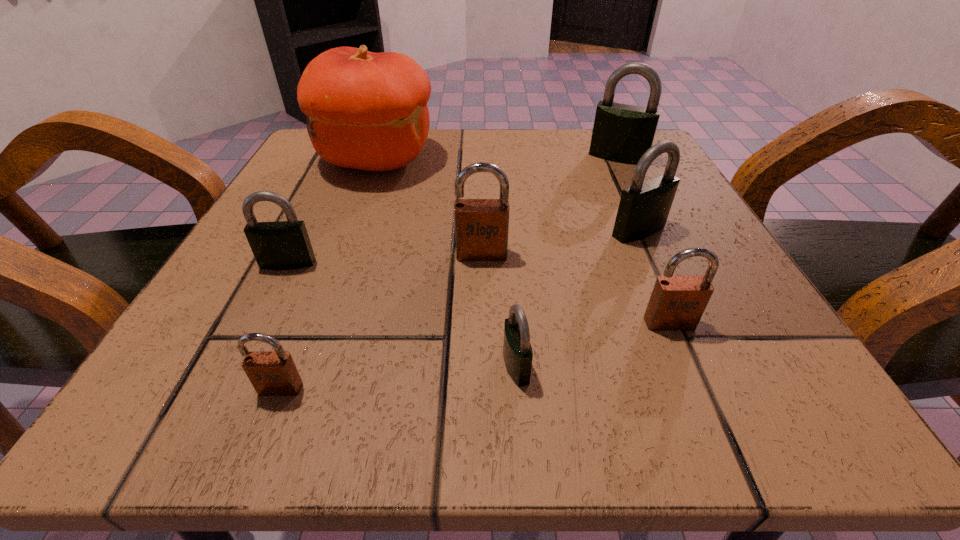
The height and width of the screenshot is (540, 960). Find the location of `the fifth farthest padlock`. the fifth farthest padlock is located at coordinates (677, 302).

Identify the location of the second black padlock from left to right. (517, 351).

Find the location of a particular element. Image resolution: width=960 pixels, height=540 pixels. the nearest black padlock is located at coordinates (517, 351).

I want to click on the nearest brown padlock, so click(x=272, y=373).

Identify the location of the smallest brown padlock. tap(272, 373).

Where is `vacant area situated 0.350m on the front of the pumpkin`? The image size is (960, 540). vacant area situated 0.350m on the front of the pumpkin is located at coordinates coord(308,341).

Where is `free spot located on the front of the biggest black padlock`? free spot located on the front of the biggest black padlock is located at coordinates (672, 265).

This screenshot has width=960, height=540. Identify the location of vacant area located on the left of the third smallest black padlock. (383, 231).

Image resolution: width=960 pixels, height=540 pixels. I want to click on free location located on the front-facing side of the second brown padlock from left to right, so click(x=482, y=328).

What are the coordinates of `vacant space located 0.210m on the front of the leftmost black padlock` in the screenshot? It's located at (220, 398).